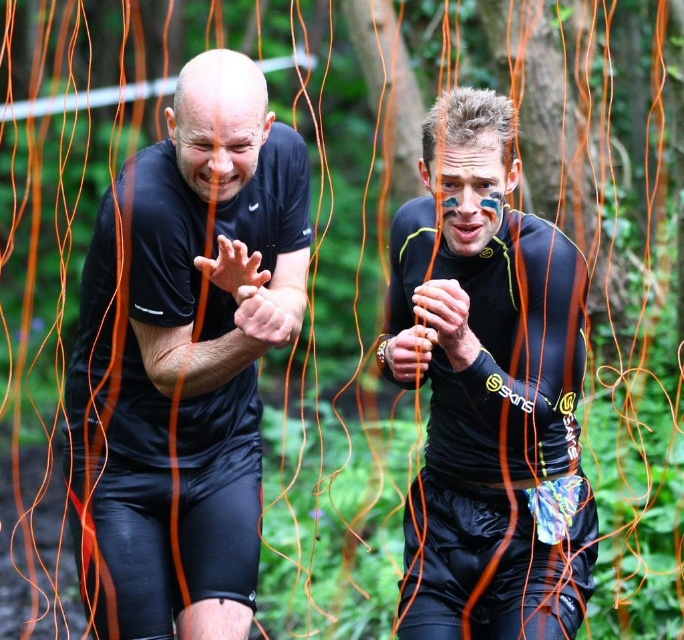
You are a photographer positioned to the right of the two participants. You need to capture a photo that includes both the black matte shirt at left and the matte black running suit at center. Which participant should you move closer to in order to ensure both are fully visible in the frame?

To ensure both the black matte shirt at left and the matte black running suit at center are fully visible in the frame, you should move closer to the black matte shirt at left. Since the matte black running suit at center is behind the black matte shirt at left, moving closer to the front participant allows the camera to capture both subjects without obstruction.

You are a photographer trying to capture a photo of both the black matte shirt at left and the matte black running suit at center. Since you want both subjects to appear in the frame, which one should you focus on first to ensure proper focus on both?

The black matte shirt at left is taller than the matte black running suit at center, so focusing on the taller subject first will help ensure both are in focus.